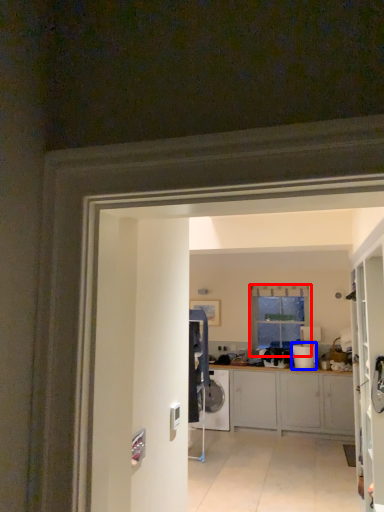
Question: Which point is further to the camera, window (highlighted by a red box) or appliance (highlighted by a blue box)?

Choices:
 (A) window
 (B) appliance

Answer: (A)